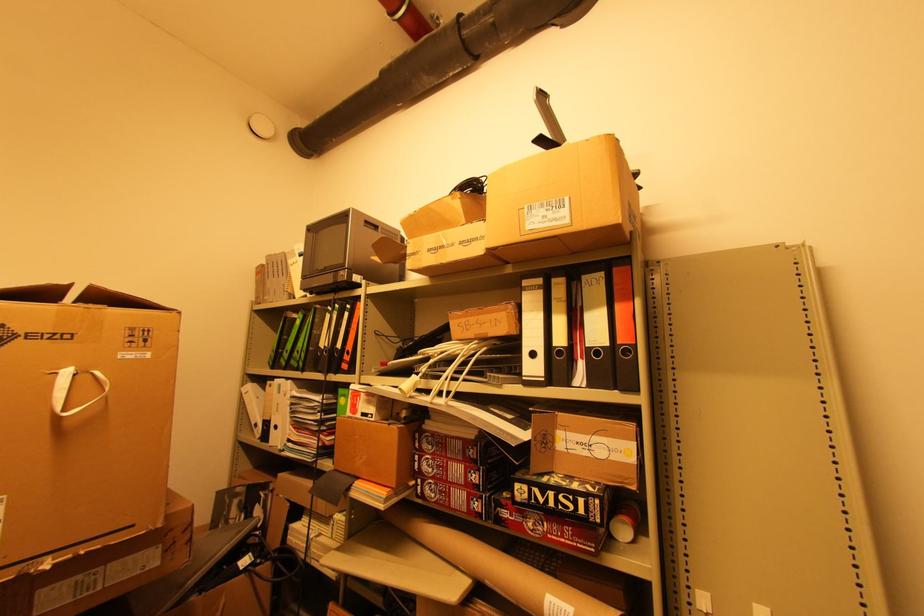
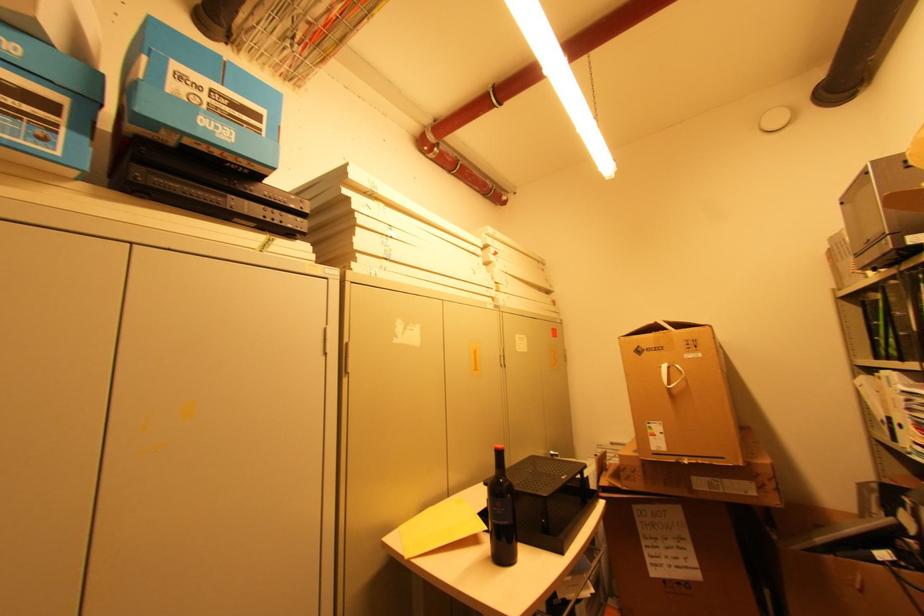
Question: The images are taken continuously from a first-person perspective. In which direction is your viewpoint rotating?

Choices:
 (A) Left
 (B) Right
 (C) Up
 (D) Down

Answer: (A)